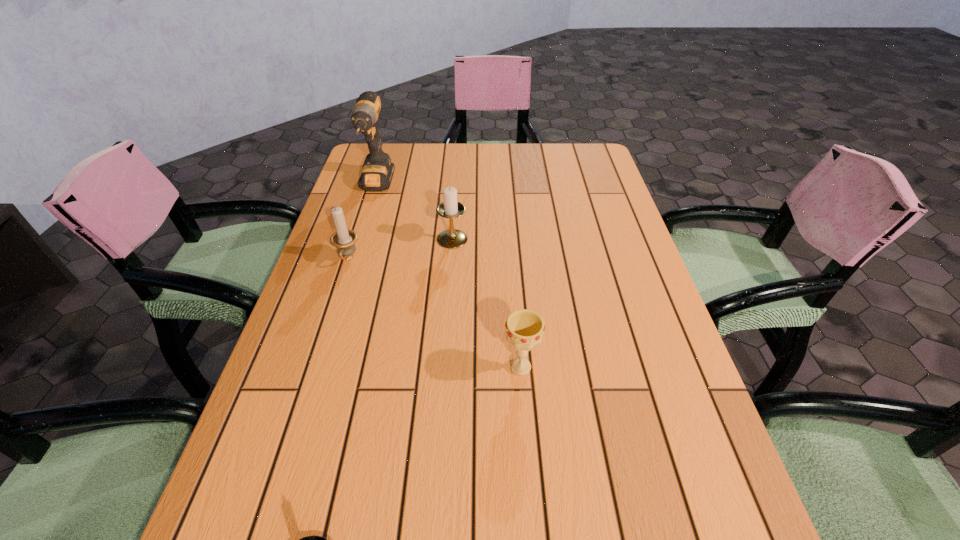
The image size is (960, 540). Identify the location of drill. (377, 172).

The width and height of the screenshot is (960, 540). In order to click on the tallest object in this screenshot , I will do `click(377, 172)`.

Identify the location of the fourth object from left to right. The image size is (960, 540). (451, 238).

Locate an element on the screen. Image resolution: width=960 pixels, height=540 pixels. the leftmost candle holder is located at coordinates (344, 240).

Image resolution: width=960 pixels, height=540 pixels. Identify the location of chalice. 524,328.

The height and width of the screenshot is (540, 960). I want to click on the rightmost object, so click(x=524, y=328).

This screenshot has width=960, height=540. In order to click on vacant space located with the drill bit of the tallest object facing forward in this screenshot , I will do `click(339, 307)`.

The width and height of the screenshot is (960, 540). I want to click on vacant space located 0.080m on the left of the fourth object from left to right, so tap(406, 239).

Where is `free space located 0.370m on the handle side of the leftmost candle holder`? The height and width of the screenshot is (540, 960). free space located 0.370m on the handle side of the leftmost candle holder is located at coordinates (300, 407).

I want to click on vacant region located 0.160m on the back of the rightmost object, so click(516, 296).